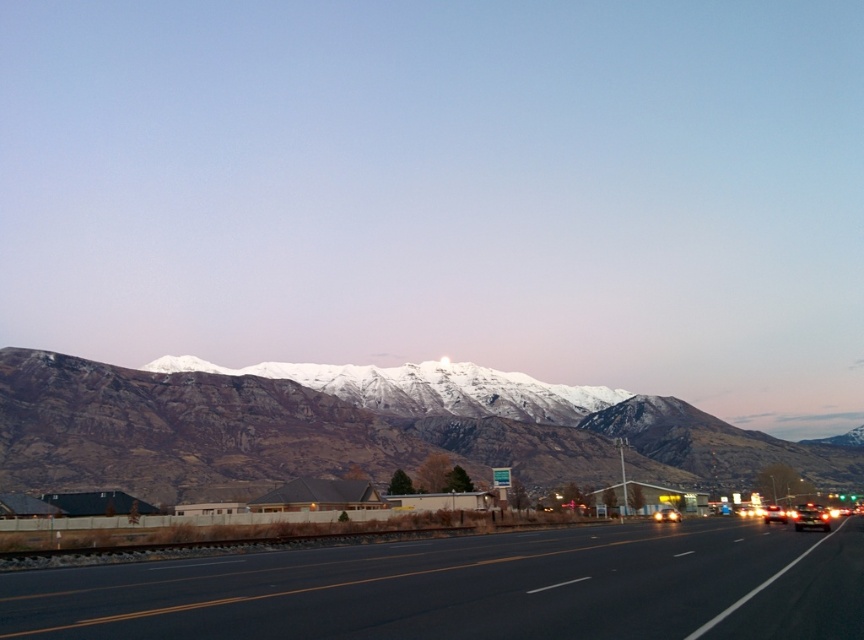
Question: Which point is farther to the camera?

Choices:
 (A) shiny black sedan at right
 (B) shiny silver sedan at center
 (C) black asphalt highway at center
 (D) metallic silver sedan at center-right

Answer: (B)

Question: In this image, where is shiny black sedan at right located relative to shiny silver sedan at center?

Choices:
 (A) left
 (B) right

Answer: (B)

Question: Which of these objects is positioned closest to the shiny black sedan at right?

Choices:
 (A) shiny silver sedan at center
 (B) rocky brown mountain range at upper center
 (C) black asphalt highway at center
 (D) metallic silver sedan at center-right

Answer: (D)

Question: Which object is positioned farthest from the metallic silver sedan at center-right?

Choices:
 (A) black asphalt highway at center
 (B) rocky brown mountain range at upper center
 (C) shiny silver sedan at center
 (D) shiny black sedan at right

Answer: (B)

Question: Is shiny black sedan at right below shiny silver sedan at center?

Choices:
 (A) no
 (B) yes

Answer: (B)

Question: Does black asphalt highway at center appear on the left side of shiny silver sedan at center?

Choices:
 (A) no
 (B) yes

Answer: (B)